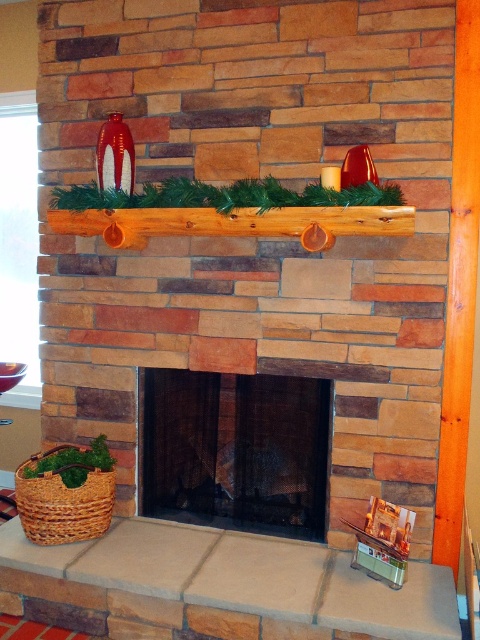
You are trying to place a large decorative piece on the mantel. Based on the image, which object is wider, the smooth wood mantel at center or the black mesh fireplace at center?

The smooth wood mantel at center is wider than the black mesh fireplace at center according to the description.

You are standing in front of the fireplace and want to hang a picture on the brown wooden mantel at center. Can you reach the mantel without moving the black mesh fireplace at center?

The brown wooden mantel at center is behind the black mesh fireplace at center, so you cannot reach it without moving the black mesh fireplace at center.

Consider the image. You are a painter standing 2 meters away from the fireplace. You want to paint the smooth wood mantel at center. Can you reach it with your 2.5 meter long painter pole?

The smooth wood mantel at center is 1.77 meters from camera. Since you are standing 2 meters away, the total distance is 2 meters plus the painter pole length of 2.5 meters, which is sufficient to reach the mantel.